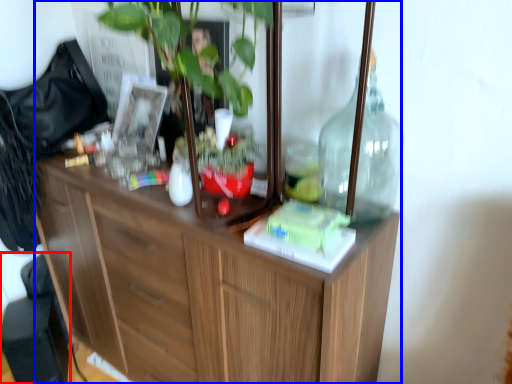
Question: Among these objects, which one is nearest to the camera, swivel chair (highlighted by a red box) or cabinetry (highlighted by a blue box)?

Choices:
 (A) swivel chair
 (B) cabinetry

Answer: (B)